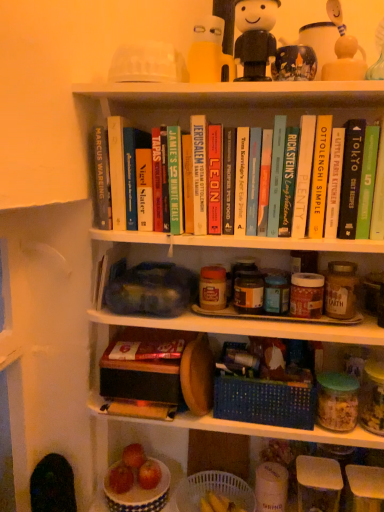
Question: Does hardcover book at center, arranged as the 5th book when viewed from the left, have a lesser width compared to red matte apple at lower center, the 2th apple viewed from the left?

Choices:
 (A) no
 (B) yes

Answer: (A)

Question: Is hardcover book at center, arranged as the 5th book when viewed from the left, to the right of red matte apple at lower center, the 2th apple viewed from the left, from the viewer's perspective?

Choices:
 (A) yes
 (B) no

Answer: (A)

Question: Is hardcover book at center, arranged as the 5th book when viewed from the left, behind red matte apple at lower center, which ranks as the 2th apple in right-to-left order?

Choices:
 (A) no
 (B) yes

Answer: (A)

Question: Is hardcover book at center, arranged as the 8th book when viewed from the right, bigger than red matte apple at lower center, the 2th apple viewed from the left?

Choices:
 (A) no
 (B) yes

Answer: (B)

Question: Considering the relative sizes of hardcover book at center, arranged as the 5th book when viewed from the left, and red matte apple at lower center, which ranks as the 2th apple in right-to-left order, in the image provided, is hardcover book at center, arranged as the 5th book when viewed from the left, shorter than red matte apple at lower center, which ranks as the 2th apple in right-to-left order,?

Choices:
 (A) no
 (B) yes

Answer: (A)

Question: Considering the relative positions of matte yellow figurine at upper right, which is the 3th toy in left-to-right order, and green matte book at upper right, marked as the 1th book in a right-to-left arrangement, in the image provided, is matte yellow figurine at upper right, which is the 3th toy in left-to-right order, to the left or to the right of green matte book at upper right, marked as the 1th book in a right-to-left arrangement,?

Choices:
 (A) right
 (B) left

Answer: (B)

Question: Looking at their shapes, would you say matte yellow figurine at upper right, which is the 3th toy in left-to-right order, is wider or thinner than green matte book at upper right, the 12th book positioned from the left?

Choices:
 (A) wide
 (B) thin

Answer: (B)

Question: From a real-world perspective, relative to green matte book at upper right, marked as the 1th book in a right-to-left arrangement, is matte yellow figurine at upper right, which ranks as the 1th toy in right-to-left order, vertically above or below?

Choices:
 (A) above
 (B) below

Answer: (A)

Question: From the image's perspective, is matte yellow figurine at upper right, which ranks as the 1th toy in right-to-left order, located above or below green matte book at upper right, marked as the 1th book in a right-to-left arrangement?

Choices:
 (A) above
 (B) below

Answer: (A)

Question: Considering the positions of hardcover book at upper left, the 12th book positioned from the right, and white ceramic bowl at lower left, the 3th shelf viewed from the top, in the image, is hardcover book at upper left, the 12th book positioned from the right, taller or shorter than white ceramic bowl at lower left, the 3th shelf viewed from the top,?

Choices:
 (A) short
 (B) tall

Answer: (B)

Question: From the image's perspective, is hardcover book at upper left, the first book viewed from the left, located above or below white ceramic bowl at lower left, positioned as the first shelf in bottom-to-top order?

Choices:
 (A) below
 (B) above

Answer: (B)

Question: Is hardcover book at upper left, the 12th book positioned from the right, situated inside white ceramic bowl at lower left, positioned as the first shelf in bottom-to-top order, or outside?

Choices:
 (A) inside
 (B) outside

Answer: (B)

Question: In the image, is hardcover book at upper left, the first book viewed from the left, positioned in front of or behind white ceramic bowl at lower left, positioned as the first shelf in bottom-to-top order?

Choices:
 (A) front
 (B) behind

Answer: (A)

Question: In terms of width, does white ceramic bowl at lower left, the 3th shelf viewed from the top, look wider or thinner when compared to white plastic basket at lower center, which ranks as the 1th basket in bottom-to-top order?

Choices:
 (A) wide
 (B) thin

Answer: (B)

Question: In terms of height, does white ceramic bowl at lower left, the 3th shelf viewed from the top, look taller or shorter compared to white plastic basket at lower center, which ranks as the 1th basket in bottom-to-top order?

Choices:
 (A) tall
 (B) short

Answer: (B)